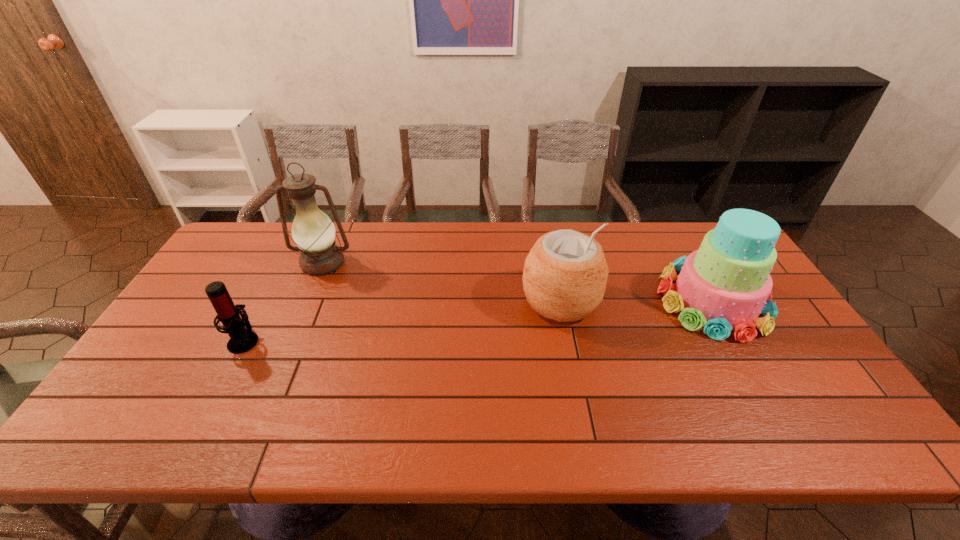
Find the location of a particular element. Image resolution: width=960 pixels, height=540 pixels. vacant space in between the tallest object and the rightmost object is located at coordinates (517, 282).

Locate an element on the screen. The width and height of the screenshot is (960, 540). empty space between the cake and the third object from left to right is located at coordinates (636, 301).

Find the location of a particular element. The height and width of the screenshot is (540, 960). free space between the oil lamp and the rightmost object is located at coordinates (517, 282).

I want to click on free point between the cake and the second object from right to left, so click(x=636, y=301).

Identify which object is the second nearest to the coconut. Please provide its 2D coordinates. Your answer should be formatted as a tuple, i.e. [(x, y)], where the tuple contains the x and y coordinates of a point satisfying the conditions above.

[(313, 232)]

Find the location of a particular element. object that stands as the second closest to the second object from right to left is located at coordinates (313, 232).

You are a GUI agent. You are given a task and a screenshot of the screen. Output one action in this format:
    pyautogui.click(x=<x>, y=<y>)
    Task: Click on the blank area in the image that satisfies the following two spatial constraints: 1. on the back side of the rightmost object; 2. on the right side of the coconut
    The height and width of the screenshot is (540, 960).
    Given the screenshot: What is the action you would take?
    pyautogui.click(x=561, y=301)

The width and height of the screenshot is (960, 540). I want to click on vacant space that satisfies the following two spatial constraints: 1. on the front side of the oil lamp; 2. on the right side of the third object from left to right, so click(x=306, y=301).

Image resolution: width=960 pixels, height=540 pixels. What are the coordinates of `vacant position in the image that satisfies the following two spatial constraints: 1. on the back side of the microphone; 2. on the left side of the second object from right to left` in the screenshot? It's located at (265, 301).